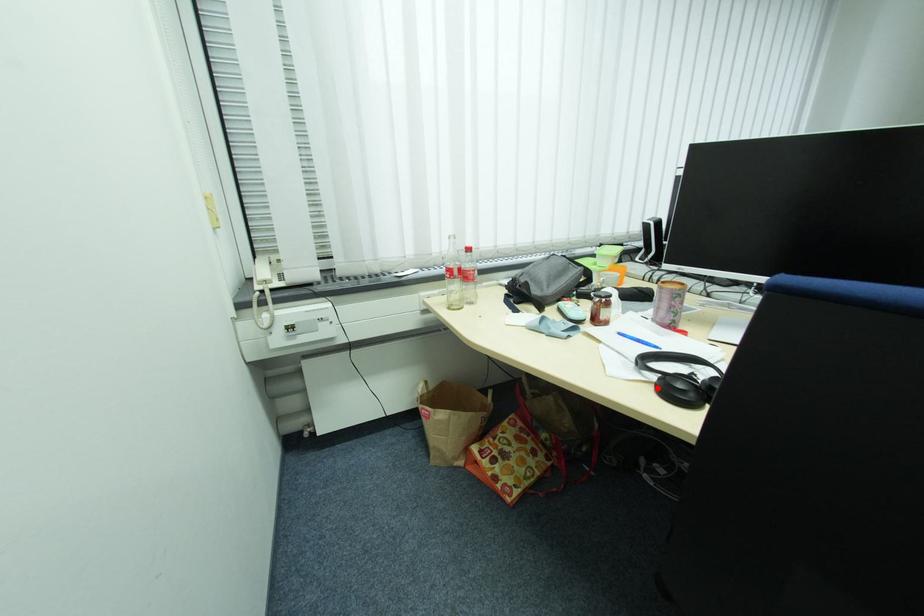
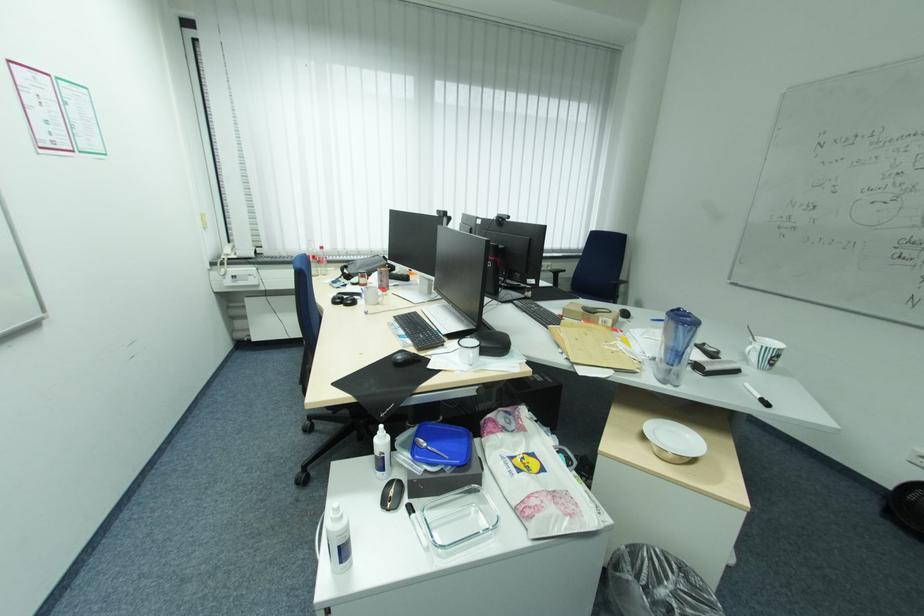
Question: I am providing you with two images of the same scene from different viewpoints. A red point is marked on the first image. At the location where the point appears in image 1, is it still visible in image 2?

Choices:
 (A) Yes
 (B) No

Answer: (B)